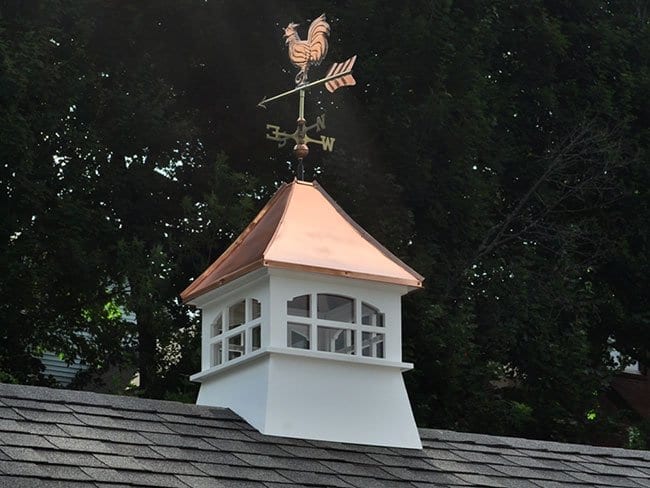
Where is `window`? window is located at coordinates (342, 310), (240, 318), (237, 348), (378, 342).